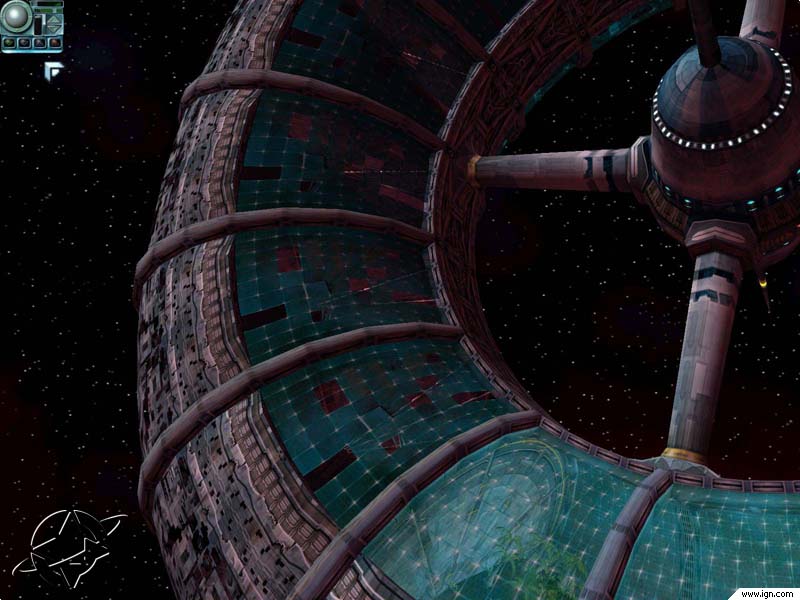
You are a GUI agent. You are given a task and a screenshot of the screen. Output one action in this format:
    pyautogui.click(x=<x>, y=<y>)
    Task: Click on the yellow light to the right
    The image size is (800, 600).
    Given the screenshot: What is the action you would take?
    pyautogui.click(x=764, y=281)